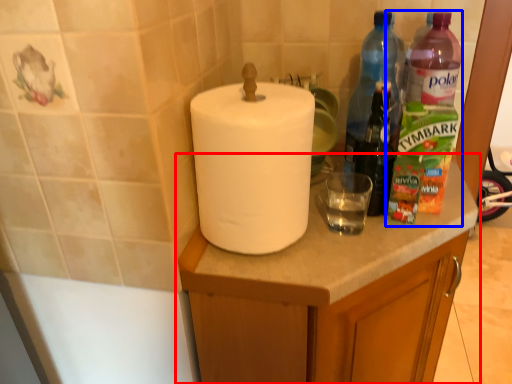
Question: Which object appears farthest to the camera in this image, cabinetry (highlighted by a red box) or bottle (highlighted by a blue box)?

Choices:
 (A) cabinetry
 (B) bottle

Answer: (B)